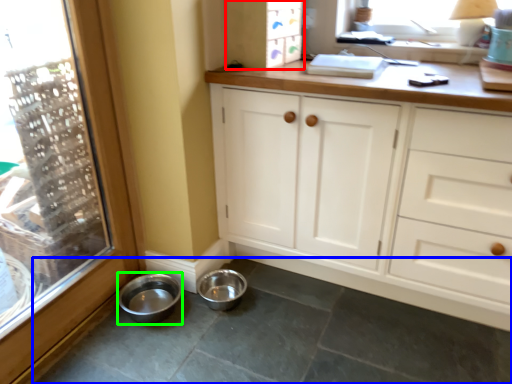
Question: Estimate the real-world distances between objects in this image. Which object is closer to cabinetry (highlighted by a red box), concrete (highlighted by a blue box) or basin (highlighted by a green box)?

Choices:
 (A) concrete
 (B) basin

Answer: (B)